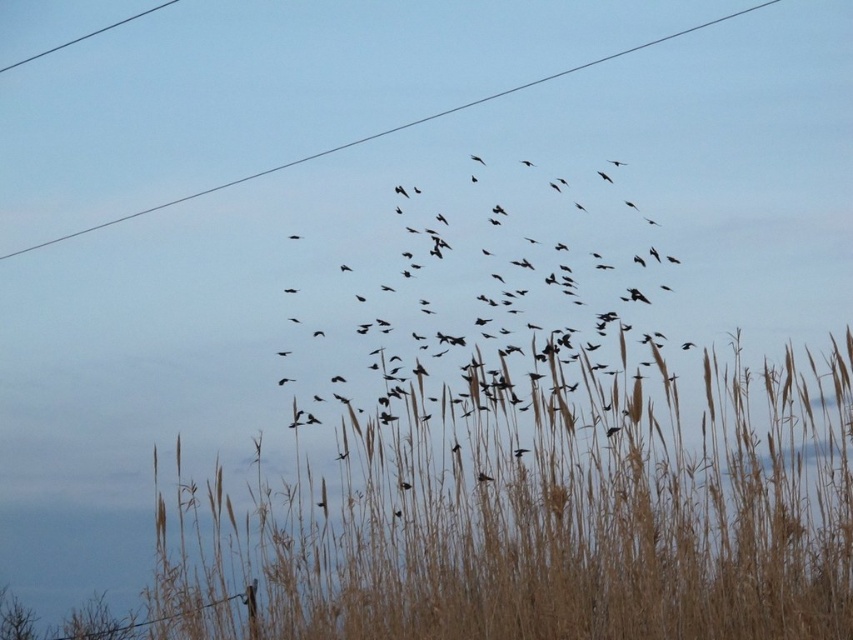
Question: Among these objects, which one is farthest from the camera?

Choices:
 (A) black matte birds at center
 (B) brown dry grass at lower center
 (C) black wire at upper left
 (D) black wire at upper center

Answer: (C)

Question: Does brown dry grass at lower center appear over black matte birds at center?

Choices:
 (A) no
 (B) yes

Answer: (A)

Question: Is brown dry grass at lower center thinner than black wire at upper left?

Choices:
 (A) yes
 (B) no

Answer: (B)

Question: Which object is farther from the camera taking this photo?

Choices:
 (A) black wire at upper left
 (B) brown dry grass at lower center
 (C) black wire at upper center

Answer: (A)

Question: Is brown dry grass at lower center below black matte birds at center?

Choices:
 (A) yes
 (B) no

Answer: (A)

Question: Among these points, which one is nearest to the camera?

Choices:
 (A) (222, 188)
 (B) (28, 61)
 (C) (373, 442)
 (D) (532, 211)

Answer: (C)